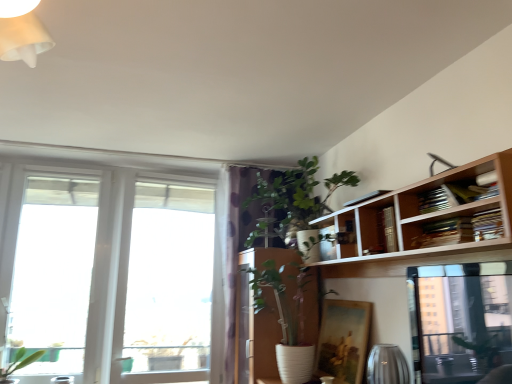
The height and width of the screenshot is (384, 512). Identify the location of wooden bookshelf at upper right. (420, 215).

At what (x,y) coordinates should I click in order to perform the action: click on transparent glass window at left, positioned as the 1th window in right-to-left order. Please return your answer as a coordinate pair (x, y). Looking at the image, I should click on (169, 284).

This screenshot has width=512, height=384. What do you see at coordinates (50, 269) in the screenshot?
I see `transparent glass window at left, which is counted as the 2th window, starting from the right` at bounding box center [50, 269].

Identify the location of green leafy plant at upper center. Image resolution: width=512 pixels, height=384 pixels. (298, 195).

Is transparent glass window at left, which is the second window in left-to-right order, situated inside green leafy plant at upper center or outside?

transparent glass window at left, which is the second window in left-to-right order, cannot be found inside green leafy plant at upper center.

Is transparent glass window at left, which is the second window in left-to-right order, far away from green leafy plant at upper center?

Yes, transparent glass window at left, which is the second window in left-to-right order, and green leafy plant at upper center are located far from each other.

Consider the image. Which object is closer to the camera taking this photo, transparent glass window at left, which is the second window in left-to-right order, or green leafy plant at upper center?

green leafy plant at upper center is closer to the camera.

From the image's perspective, which is below, transparent glass window at left, which is the second window in left-to-right order, or green leafy plant at upper center?

From the image's view, transparent glass window at left, which is the second window in left-to-right order, is below.

In the scene shown: Who is taller, wooden bookshelf at upper right or transparent glass window at left, which is counted as the 2th window, starting from the right?

Standing taller between the two is transparent glass window at left, which is counted as the 2th window, starting from the right.

The width and height of the screenshot is (512, 384). In the image, there is a transparent glass window at left, the 1th window viewed from the left. In order to click on bookshelf above it (from the image's perspective) in this screenshot , I will do `click(420, 215)`.

Is wooden bookshelf at upper right turned away from transparent glass window at left, the 1th window viewed from the left?

No, wooden bookshelf at upper right's orientation is not away from transparent glass window at left, the 1th window viewed from the left.

From the image's perspective, is purple dotted fabric at center positioned above or below transparent glass window at left, which is the second window in left-to-right order?

From the image's perspective, purple dotted fabric at center appears above transparent glass window at left, which is the second window in left-to-right order.

Looking at their sizes, would you say purple dotted fabric at center is wider or thinner than transparent glass window at left, which is the second window in left-to-right order?

In the image, purple dotted fabric at center appears to be wider than transparent glass window at left, which is the second window in left-to-right order.

From the picture: Is purple dotted fabric at center taller than transparent glass window at left, which is the second window in left-to-right order?

Correct, purple dotted fabric at center is much taller as transparent glass window at left, which is the second window in left-to-right order.

Does point (506, 152) come in front of point (225, 234)?

Yes, it is in front of point (225, 234).

Is wooden bookshelf at upper right next to purple dotted fabric at center and touching it?

There is a gap between wooden bookshelf at upper right and purple dotted fabric at center.

Between wooden bookshelf at upper right and purple dotted fabric at center, which one is positioned behind?

purple dotted fabric at center is further from the camera.

Which object is positioned more to the left, wooden bookshelf at upper right or purple dotted fabric at center?

From the viewer's perspective, purple dotted fabric at center appears more on the left side.

Is transparent glass window at left, which is the second window in left-to-right order, bigger or smaller than transparent glass window at left, which is counted as the 2th window, starting from the right?

Considering their sizes, transparent glass window at left, which is the second window in left-to-right order, takes up more space than transparent glass window at left, which is counted as the 2th window, starting from the right.

Based on the photo, is transparent glass window at left, positioned as the 1th window in right-to-left order, taller or shorter than transparent glass window at left, the 1th window viewed from the left?

transparent glass window at left, positioned as the 1th window in right-to-left order, is shorter than transparent glass window at left, the 1th window viewed from the left.

From a real-world perspective, is transparent glass window at left, positioned as the 1th window in right-to-left order, physically above transparent glass window at left, which is counted as the 2th window, starting from the right?

Incorrect, from a real-world perspective, transparent glass window at left, positioned as the 1th window in right-to-left order, is lower than transparent glass window at left, which is counted as the 2th window, starting from the right.

Between transparent glass window at left, which is the second window in left-to-right order, and transparent glass window at left, which is counted as the 2th window, starting from the right, which one has smaller width?

Thinner between the two is transparent glass window at left, which is counted as the 2th window, starting from the right.

Could you tell me if green leafy plant at upper center is turned towards transparent glass window at left, positioned as the 1th window in right-to-left order?

No, green leafy plant at upper center is not facing towards transparent glass window at left, positioned as the 1th window in right-to-left order.

Where is `the 1st window to the left when counting from the green leafy plant at upper center`? This screenshot has height=384, width=512. the 1st window to the left when counting from the green leafy plant at upper center is located at coordinates (169, 284).

Does green leafy plant at upper center have a larger size compared to transparent glass window at left, which is the second window in left-to-right order?

Yes, green leafy plant at upper center is bigger than transparent glass window at left, which is the second window in left-to-right order.

Between green leafy plant at upper center and transparent glass window at left, which is the second window in left-to-right order, which one appears on the right side from the viewer's perspective?

Positioned to the right is green leafy plant at upper center.

Is transparent glass window at left, the 1th window viewed from the left, wider or thinner than transparent glass window at left, which is the second window in left-to-right order?

transparent glass window at left, the 1th window viewed from the left, is thinner than transparent glass window at left, which is the second window in left-to-right order.

The image size is (512, 384). In order to click on window above the transparent glass window at left, positioned as the 1th window in right-to-left order (from a real-world perspective) in this screenshot , I will do `click(50, 269)`.

Considering the relative positions of transparent glass window at left, the 1th window viewed from the left, and transparent glass window at left, positioned as the 1th window in right-to-left order, in the image provided, is transparent glass window at left, the 1th window viewed from the left, to the left of transparent glass window at left, positioned as the 1th window in right-to-left order, from the viewer's perspective?

Correct, you'll find transparent glass window at left, the 1th window viewed from the left, to the left of transparent glass window at left, positioned as the 1th window in right-to-left order.

Who is shorter, transparent glass window at left, the 1th window viewed from the left, or transparent glass window at left, positioned as the 1th window in right-to-left order?

transparent glass window at left, positioned as the 1th window in right-to-left order.

At what (x,y) coordinates should I click in order to perform the action: click on the 2nd window positioned below the green leafy plant at upper center (from the image's perspective). Please return your answer as a coordinate pair (x, y). The image size is (512, 384). Looking at the image, I should click on (169, 284).

Locate an element on the screen. The image size is (512, 384). bookshelf lying on the right of transparent glass window at left, which is counted as the 2th window, starting from the right is located at coordinates click(x=420, y=215).

Considering their positions, is purple dotted fabric at center positioned further to green leafy plant at upper center than transparent glass window at left, positioned as the 1th window in right-to-left order?

Among the two, transparent glass window at left, positioned as the 1th window in right-to-left order, is located further to green leafy plant at upper center.

Considering their positions, is transparent glass window at left, the 1th window viewed from the left, positioned further to purple dotted fabric at center than wooden bookshelf at upper right?

Among the two, transparent glass window at left, the 1th window viewed from the left, is located further to purple dotted fabric at center.

Considering their positions, is green leafy plant at upper center positioned further to purple dotted fabric at center than transparent glass window at left, which is the second window in left-to-right order?

Based on the image, green leafy plant at upper center appears to be further to purple dotted fabric at center.

Considering their positions, is transparent glass window at left, the 1th window viewed from the left, positioned closer to green leafy plant at upper center than transparent glass window at left, positioned as the 1th window in right-to-left order?

transparent glass window at left, positioned as the 1th window in right-to-left order, is closer to green leafy plant at upper center.

Estimate the real-world distances between objects in this image. Which object is further from wooden bookshelf at upper right, transparent glass window at left, positioned as the 1th window in right-to-left order, or purple dotted fabric at center?

transparent glass window at left, positioned as the 1th window in right-to-left order, is further to wooden bookshelf at upper right.

Looking at the image, which one is located further to purple dotted fabric at center, green leafy plant at upper center or transparent glass window at left, which is counted as the 2th window, starting from the right?

Based on the image, transparent glass window at left, which is counted as the 2th window, starting from the right, appears to be further to purple dotted fabric at center.

Considering their positions, is transparent glass window at left, positioned as the 1th window in right-to-left order, positioned further to purple dotted fabric at center than wooden bookshelf at upper right?

The object further to purple dotted fabric at center is wooden bookshelf at upper right.

Considering their positions, is green leafy plant at upper center positioned closer to transparent glass window at left, which is counted as the 2th window, starting from the right, than transparent glass window at left, which is the second window in left-to-right order?

transparent glass window at left, which is the second window in left-to-right order.

The image size is (512, 384). Find the location of `houseplant positioned between wooden bookshelf at upper right and transparent glass window at left, which is the second window in left-to-right order, from near to far`. houseplant positioned between wooden bookshelf at upper right and transparent glass window at left, which is the second window in left-to-right order, from near to far is located at coordinates (298, 195).

At what (x,y) coordinates should I click in order to perform the action: click on curtain situated between transparent glass window at left, positioned as the 1th window in right-to-left order, and green leafy plant at upper center from left to right. Please return your answer as a coordinate pair (x, y). The image size is (512, 384). Looking at the image, I should click on (225, 269).

Where is `houseplant located between wooden bookshelf at upper right and purple dotted fabric at center in the depth direction`? houseplant located between wooden bookshelf at upper right and purple dotted fabric at center in the depth direction is located at coordinates (298, 195).

What are the coordinates of `window between transparent glass window at left, the 1th window viewed from the left, and purple dotted fabric at center` in the screenshot? It's located at (169, 284).